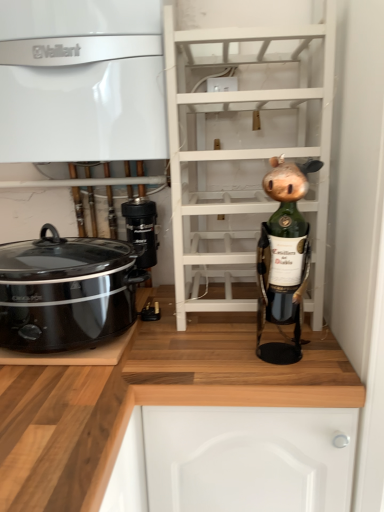
This screenshot has height=512, width=384. I want to click on vacant space to the left of green matte wine bottle at right, so point(202,356).